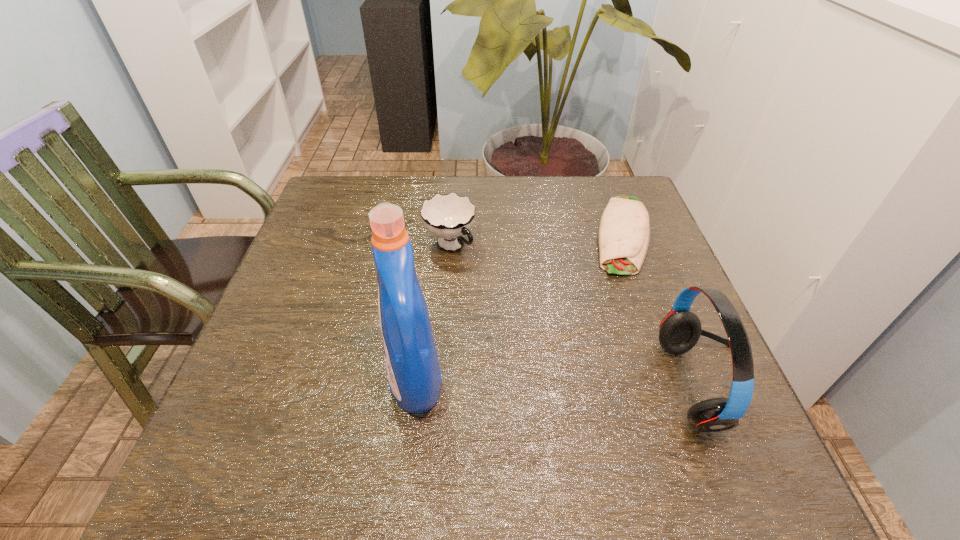
Identify the location of vacant space on the desktop that is between the detergent and the headset and is positioned on the side of the third tallest object with the handle. This screenshot has width=960, height=540. (597, 384).

Where is `free spot on the desktop that is between the tallest object and the headset and is positioned at the bitten end of the burrito`? This screenshot has width=960, height=540. free spot on the desktop that is between the tallest object and the headset and is positioned at the bitten end of the burrito is located at coordinates (606, 384).